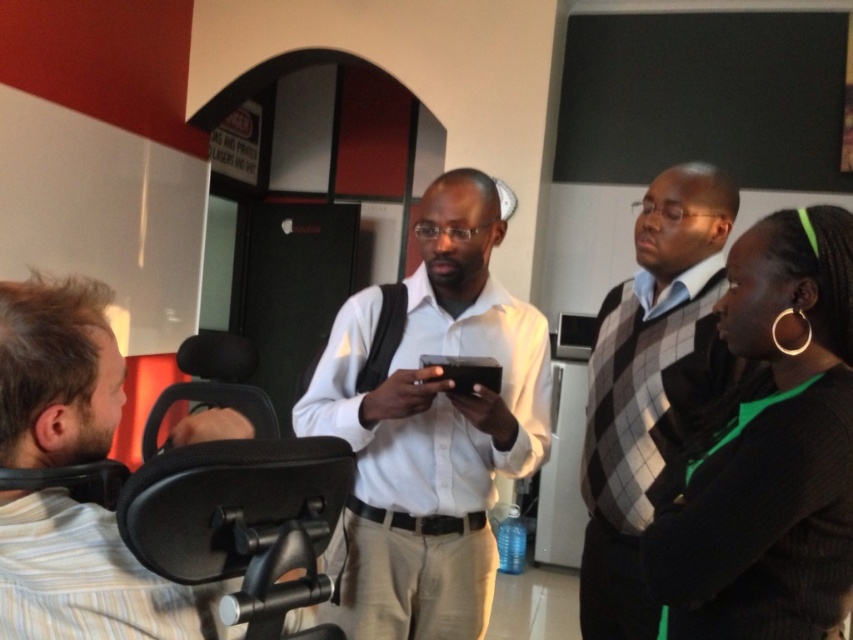
Based on the scene description, where is the light brown striped shirt located relative to the point marked at coordinates [86,579]?

The point at coordinates [86,579] marks the location of the light brown striped shirt at left.

You are a photographer trying to capture a group photo of the black knitwear at right and the gray checkered sweater at center. Since you want to ensure both are fully visible in the photo, which one should you position closer to the camera?

The black knitwear at right is in front of the gray checkered sweater at center, so positioning the black knitwear at right closer to the camera will ensure both are visible without one blocking the other.

You are organizing a clothing donation drive and need to sort items by size. You have a white matte shirt at center and a black knitwear at right. Which one should you place in the large size bin?

The white matte shirt at center is bigger than the black knitwear at right, so it should be placed in the large size bin.